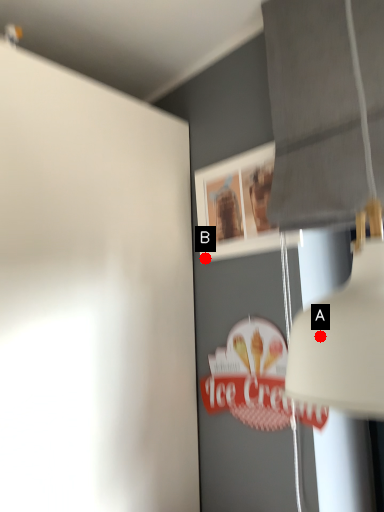
Question: Two points are circled on the image, labeled by A and B beside each circle. Which point appears closest to the camera in this image?

Choices:
 (A) A is closer
 (B) B is closer

Answer: (A)